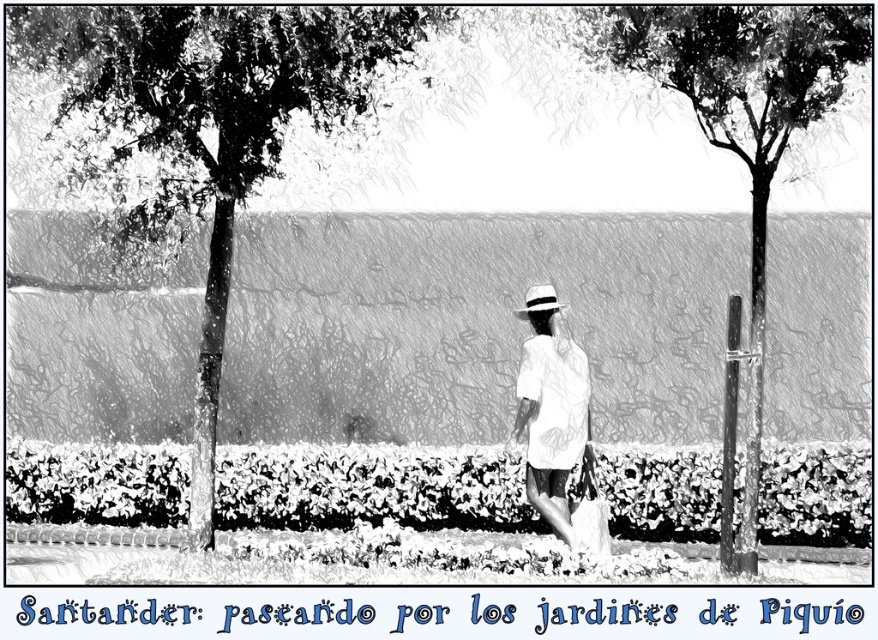
From the picture: You are a drone operator trying to fly a drone between the soft green hedge at center and the smooth bark tree at center. The drone has a wingspan of 3 meters. Can the drone safely pass through the space between them without touching either?

The soft green hedge at center is 3.53 meters from the smooth bark tree at center. Since the drone has a wingspan of 3 meters, which is narrower than the 3.53 meters distance between them, the drone can safely pass through the space without touching either.